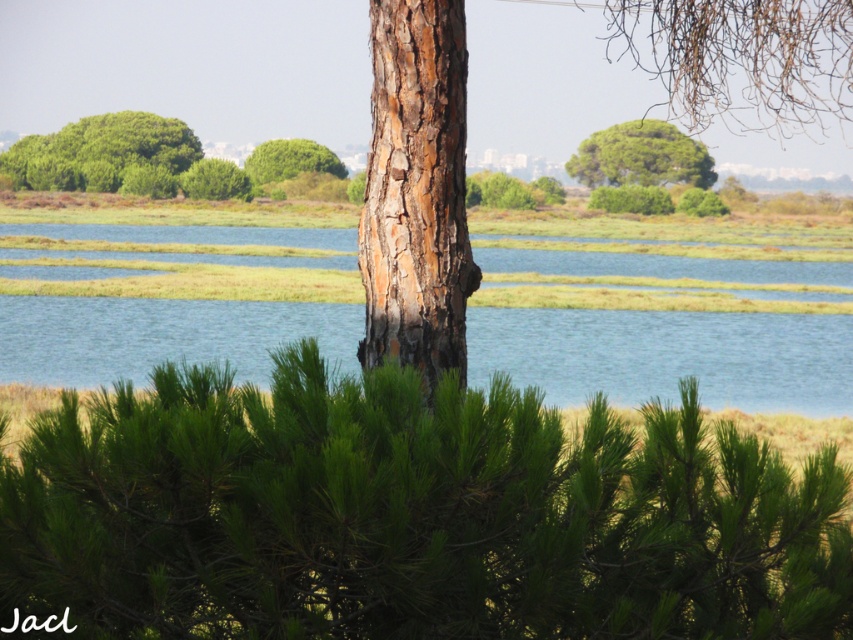
Question: Is green needle-like at center above brown rough bark at center?

Choices:
 (A) no
 (B) yes

Answer: (A)

Question: Observing the image, what is the correct spatial positioning of blue water at center in reference to green rough bark tree at upper center?

Choices:
 (A) left
 (B) right

Answer: (A)

Question: Among these objects, which one is farthest from the camera?

Choices:
 (A) green rough bark tree at upper center
 (B) green leafy tree at upper center
 (C) brown rough bark at center
 (D) green leafy tree at center

Answer: (A)

Question: Which point appears farthest from the camera in this image?

Choices:
 (A) (601, 154)
 (B) (563, 360)
 (C) (256, 186)
 (D) (838, 74)

Answer: (A)

Question: Based on their relative distances, which object is farther from the green leafy tree at center?

Choices:
 (A) green needle-like at center
 (B) green leafy tree at upper center

Answer: (A)

Question: In this image, where is blue water at center located relative to green rough bark tree at upper center?

Choices:
 (A) above
 (B) below

Answer: (B)